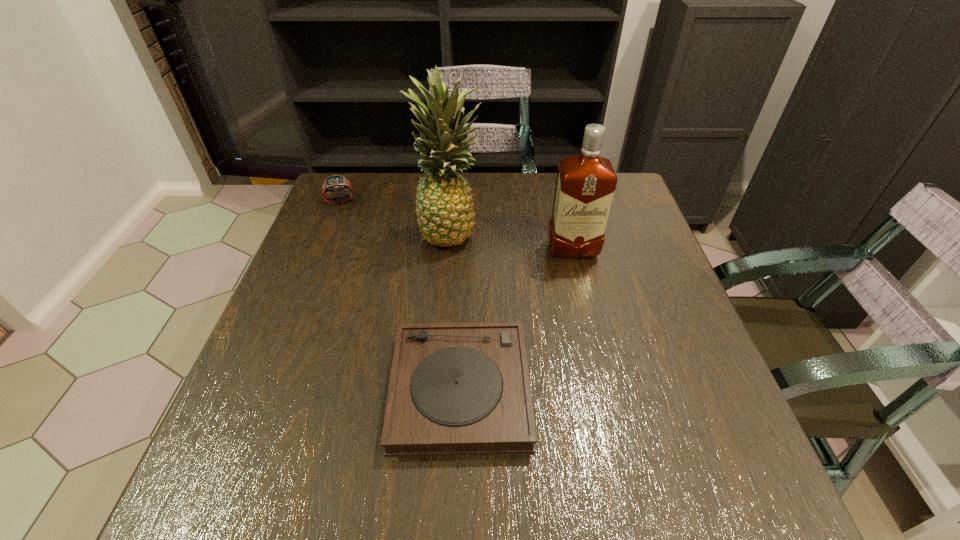
In the image, there is a desktop. At what (x,y) coordinates should I click in order to perform the action: click on vacant space at the near left corner. Please return your answer as a coordinate pair (x, y). Image resolution: width=960 pixels, height=540 pixels. Looking at the image, I should click on (286, 501).

The image size is (960, 540). Find the location of `vacant space at the far right corner`. vacant space at the far right corner is located at coordinates (624, 213).

In the image, there is a desktop. In order to click on vacant space at the near right corner in this screenshot , I will do `click(677, 501)`.

Image resolution: width=960 pixels, height=540 pixels. In order to click on vacant area that lies between the nearest object and the liquor in this screenshot , I will do `click(516, 320)`.

Locate an element on the screen. Image resolution: width=960 pixels, height=540 pixels. vacant space in between the pineapple and the nearest object is located at coordinates (455, 310).

Where is `vacant area that lies between the liquor and the phonograph record`? This screenshot has height=540, width=960. vacant area that lies between the liquor and the phonograph record is located at coordinates (516, 320).

I want to click on vacant area between the liquor and the shortest object, so click(x=516, y=320).

Find the location of a particular element. Image resolution: width=960 pixels, height=540 pixels. unoccupied area between the shortest object and the third shortest object is located at coordinates (516, 320).

Find the location of a particular element. empty location between the phonograph record and the second tallest object is located at coordinates (516, 320).

At what (x,y) coordinates should I click in order to perform the action: click on blank region between the nearest object and the farthest object. Please return your answer as a coordinate pair (x, y). Image resolution: width=960 pixels, height=540 pixels. Looking at the image, I should click on (400, 295).